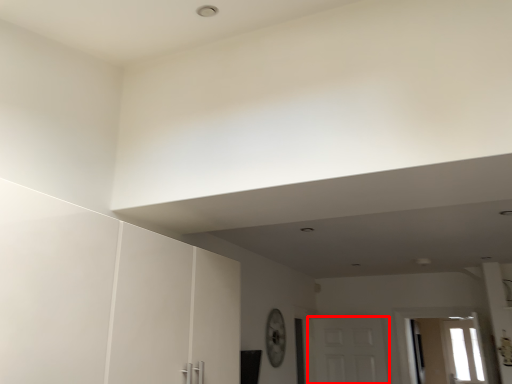
Question: In this image, where is door (annotated by the red box) located relative to window?

Choices:
 (A) left
 (B) right

Answer: (A)